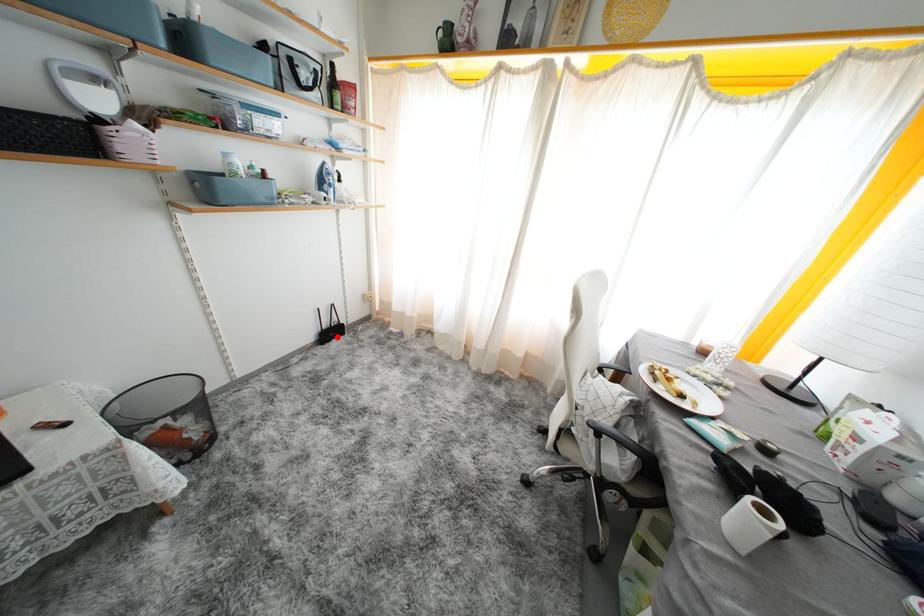
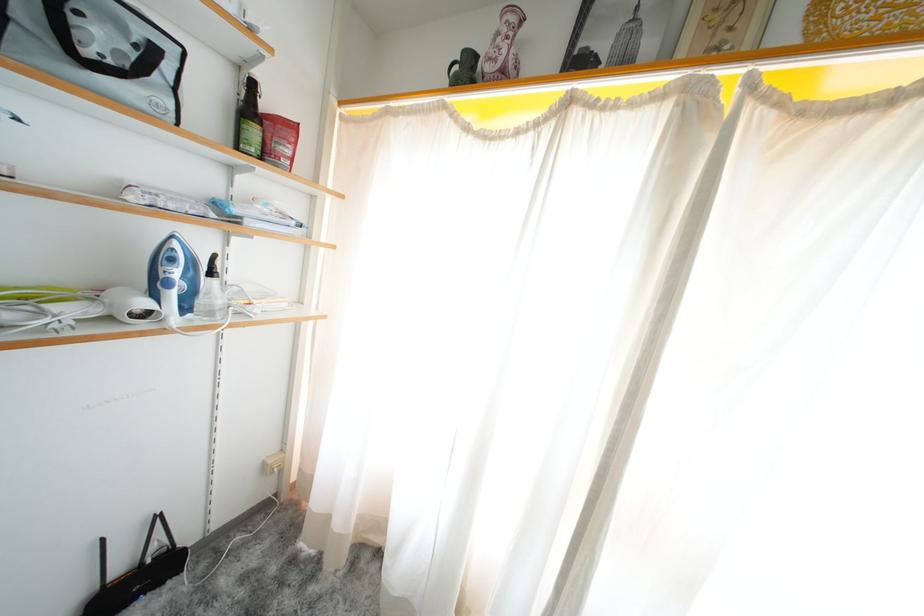
Question: I am providing you with two images of the same scene from different viewpoints. Image1 has a red point marked. In image2, the corresponding 3D location appears at what relative position? Reply with the corresponding letter.

Choices:
 (A) Closer
 (B) Farther

Answer: (B)